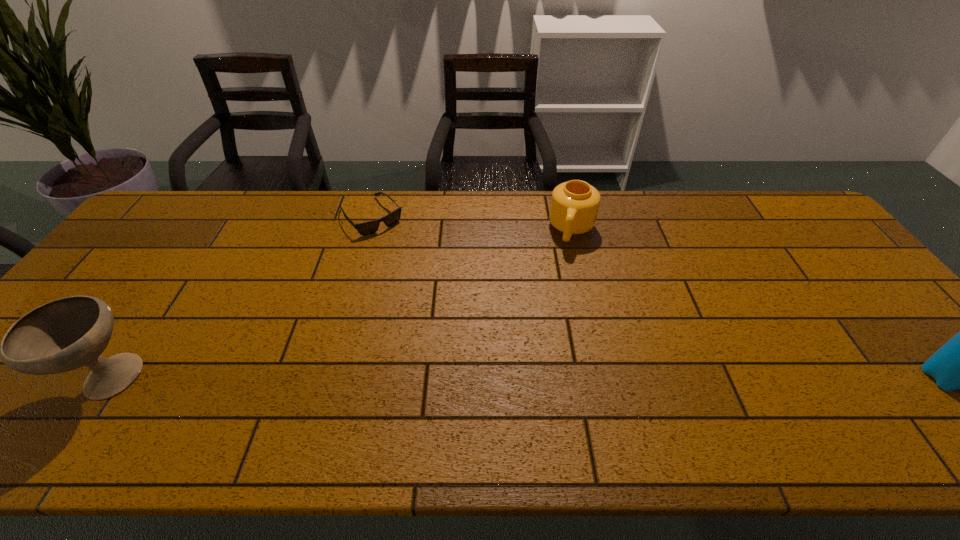
Find the location of a particular element. vacant space on the desktop that is between the chalice and the thermos bottle and is positioned on the front-facing side of the shortest object is located at coordinates (515, 379).

In order to click on vacant spot on the desktop that is between the second tallest object and the thermos bottle and is positioned on the handle side of the second object from right to left in this screenshot , I will do `click(531, 379)`.